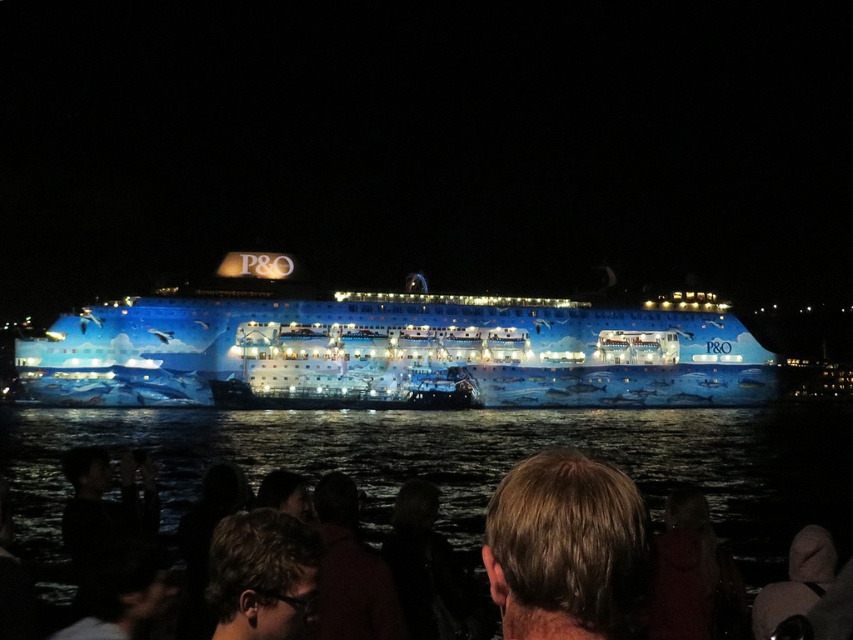
Does point (358, 381) come closer to viewer compared to point (606, 531)?

No, it is behind (606, 531).

Is blue glossy cruise ship at center below blonde hair at center?

No, blue glossy cruise ship at center is not below blonde hair at center.

Is point (770, 397) behind point (590, 536)?

Yes, point (770, 397) is farther from viewer.

In order to click on blue glossy cruise ship at center in this screenshot , I will do `click(398, 353)`.

Can you confirm if blue glossy cruise ship at center is wider than light brown hair at lower center?

Yes.

The width and height of the screenshot is (853, 640). Find the location of `blue glossy cruise ship at center`. blue glossy cruise ship at center is located at coordinates (398, 353).

Looking at this image, can you confirm if transparent water at lower center is taller than light brown hair at lower center?

Yes.

Between transparent water at lower center and light brown hair at lower center, which one appears on the left side from the viewer's perspective?

Positioned to the left is light brown hair at lower center.

Describe the element at coordinates (463, 461) in the screenshot. I see `transparent water at lower center` at that location.

I want to click on transparent water at lower center, so click(463, 461).